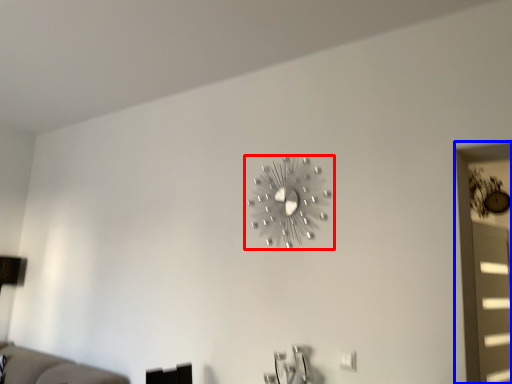
Question: Which object appears closest to the camera in this image, wall clock (highlighted by a red box) or window (highlighted by a blue box)?

Choices:
 (A) wall clock
 (B) window

Answer: (A)